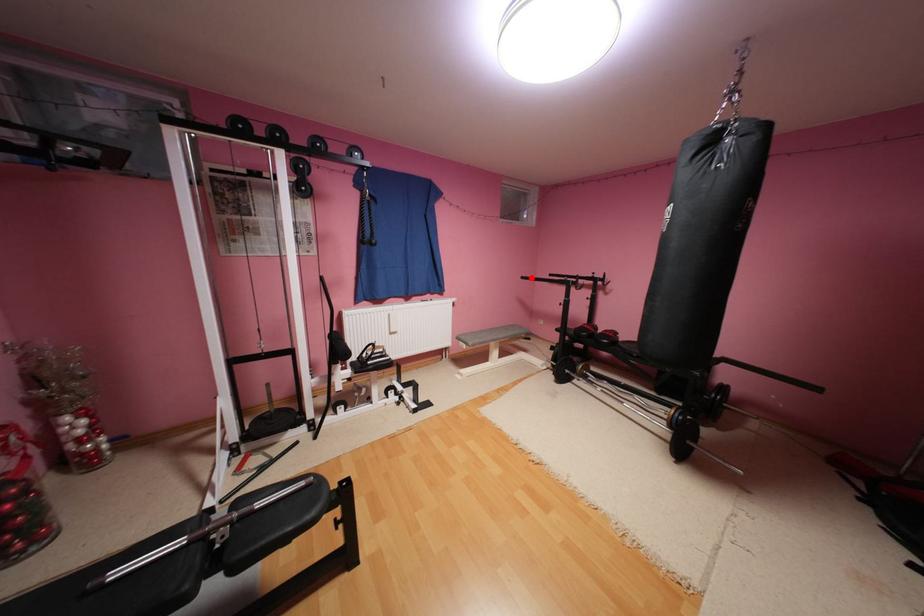
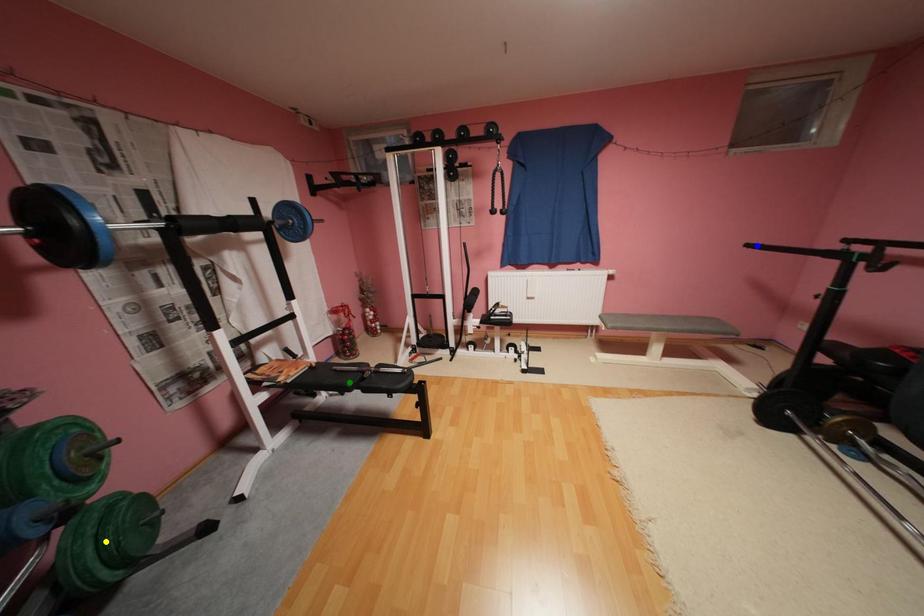
Question: I am providing you with two images of the same scene from different viewpoints. A red point is marked on the first image. You are given multiple points on the second image. Can you choose the point in image 2 that corresponds to the point in image 1?

Choices:
 (A) yellow point
 (B) green point
 (C) blue point

Answer: (C)